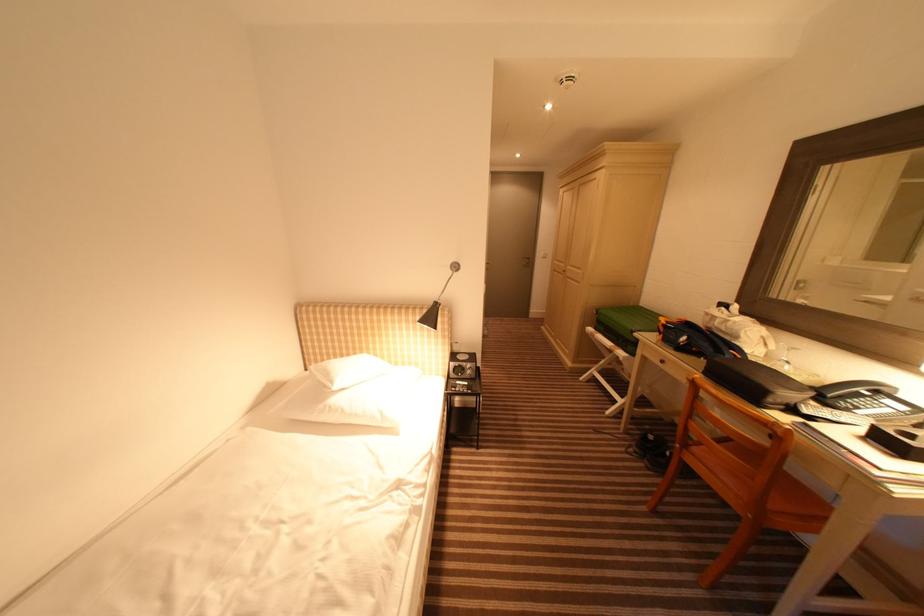
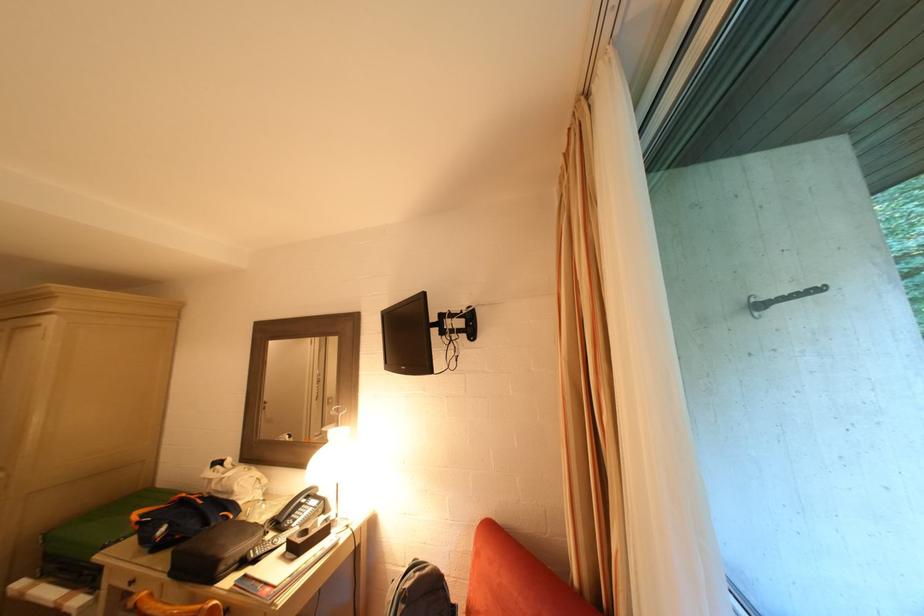
Where in the second image is the point corresponding to point 866,397 from the first image?

(306, 508)